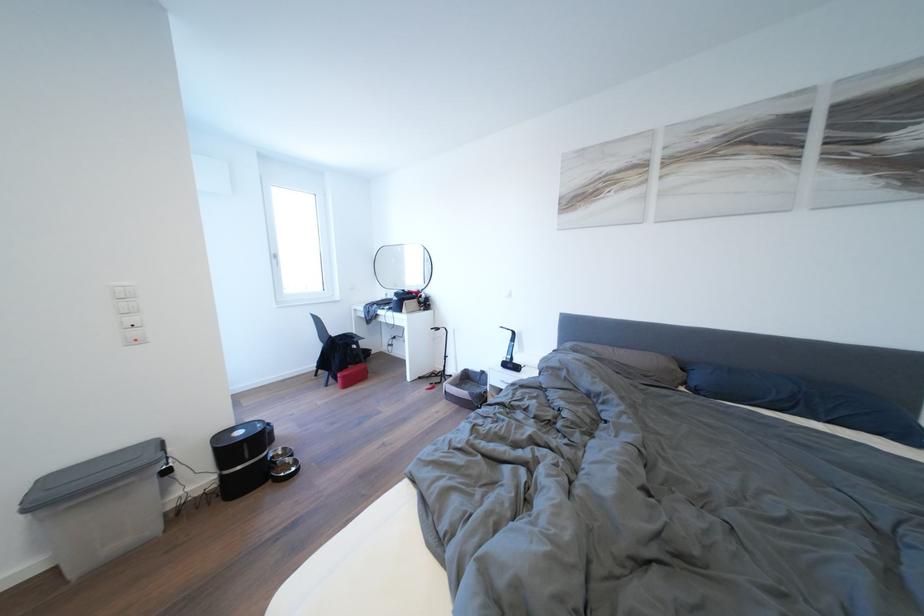
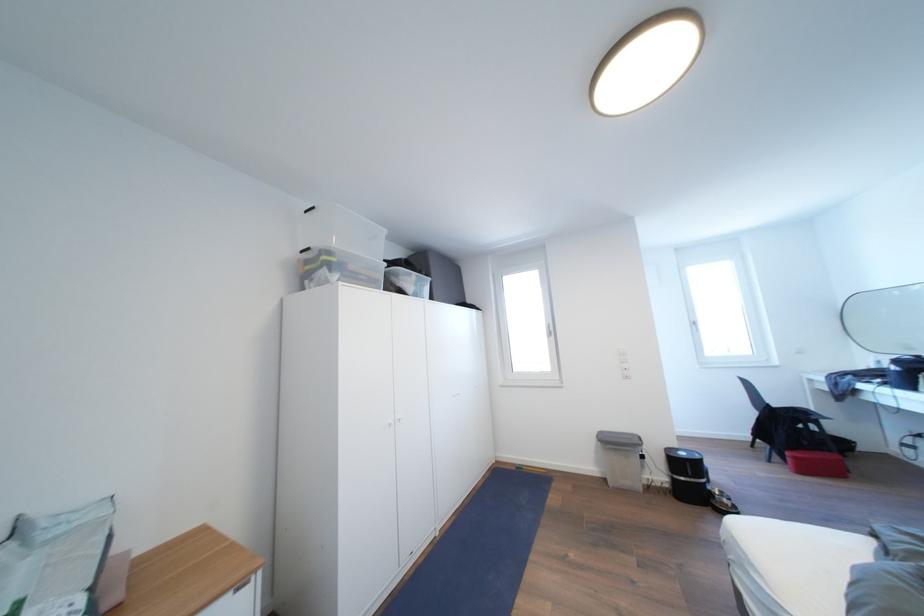
Locate, in the second image, the point that corresponds to the point at 248,438 in the first image.

(689, 459)